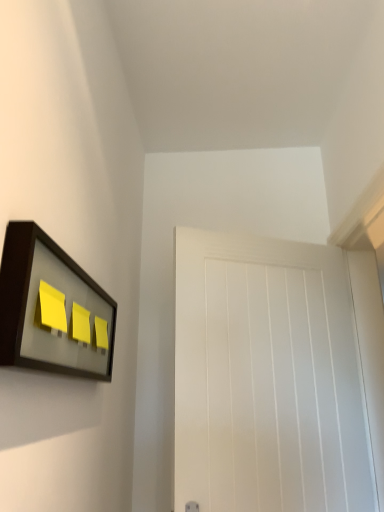
Question: Is point (23, 366) positioned closer to the camera than point (193, 428)?

Choices:
 (A) closer
 (B) farther

Answer: (A)

Question: In terms of width, does matte black picture frame at upper left look wider or thinner when compared to white matte door at center?

Choices:
 (A) thin
 (B) wide

Answer: (A)

Question: Considering the positions of matte black picture frame at upper left and white matte door at center in the image, is matte black picture frame at upper left taller or shorter than white matte door at center?

Choices:
 (A) short
 (B) tall

Answer: (A)

Question: From the image's perspective, is white matte door at center located above or below matte black picture frame at upper left?

Choices:
 (A) below
 (B) above

Answer: (A)

Question: Is point (342, 352) positioned closer to the camera than point (19, 280)?

Choices:
 (A) farther
 (B) closer

Answer: (A)

Question: Do you think white matte door at center is within matte black picture frame at upper left, or outside of it?

Choices:
 (A) outside
 (B) inside

Answer: (A)

Question: Relative to matte black picture frame at upper left, is white matte door at center in front or behind?

Choices:
 (A) behind
 (B) front

Answer: (A)